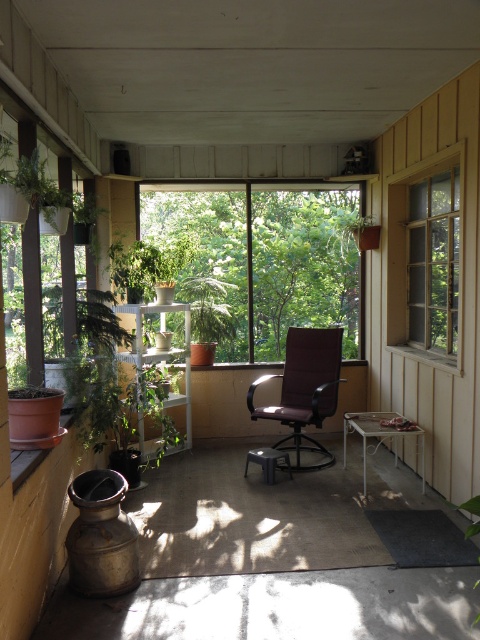
You are standing on the porch and want to look outside through the transparent glass window at center and the clear glass window at upper right. Which window is located to the left of the other?

The transparent glass window at center is positioned on the left side of clear glass window at upper right.